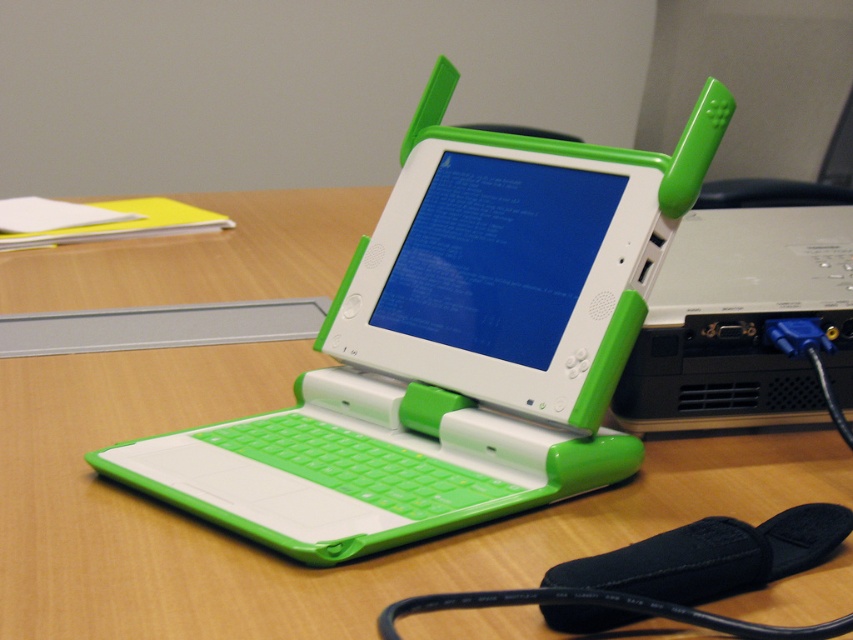
You are setting up a presentation and need to place both the green matte laptop at center and the white plastic computer at center on a table. If the table has limited space, which device should you place first to ensure both fit?

The green matte laptop at center is wider than the white plastic computer at center, so you should place the green matte laptop at center first to ensure both fit on the table.